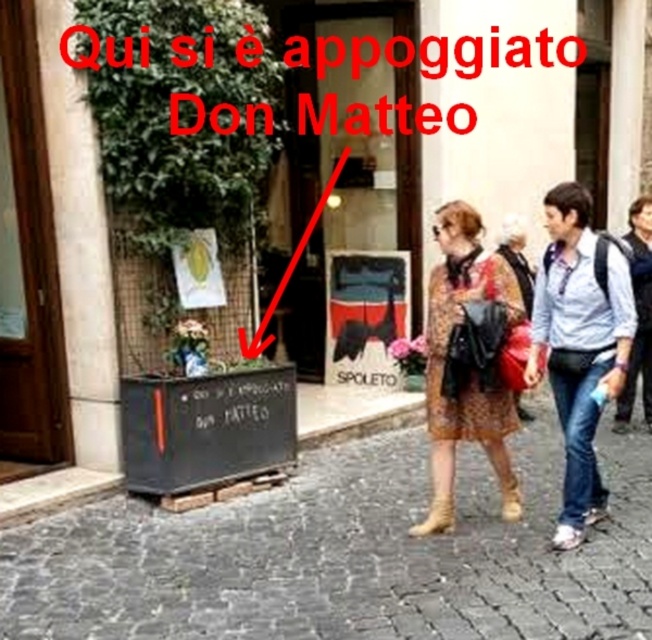
Question: Which of the following is the closest to the observer?

Choices:
 (A) blue denim jeans at lower right
 (B) leather boot at lower center

Answer: (A)

Question: Where is cobblestone pavement at lower center located in relation to brown suede boot at lower center in the image?

Choices:
 (A) right
 (B) left

Answer: (B)

Question: Does cobblestone pavement at lower center appear over leather boot at lower center?

Choices:
 (A) yes
 (B) no

Answer: (B)

Question: Can you confirm if blue denim jeans at lower right is smaller than brown suede boot at lower center?

Choices:
 (A) no
 (B) yes

Answer: (A)

Question: Which object is farther from the camera taking this photo?

Choices:
 (A) matte brown dress at center
 (B) printed fabric dress at center
 (C) patterned fabric dress at center
 (D) leather boot at lower center

Answer: (A)

Question: Which of the following is the farthest from the observer?

Choices:
 (A) pyautogui.click(x=647, y=304)
 (B) pyautogui.click(x=430, y=291)
 (C) pyautogui.click(x=572, y=392)

Answer: (A)